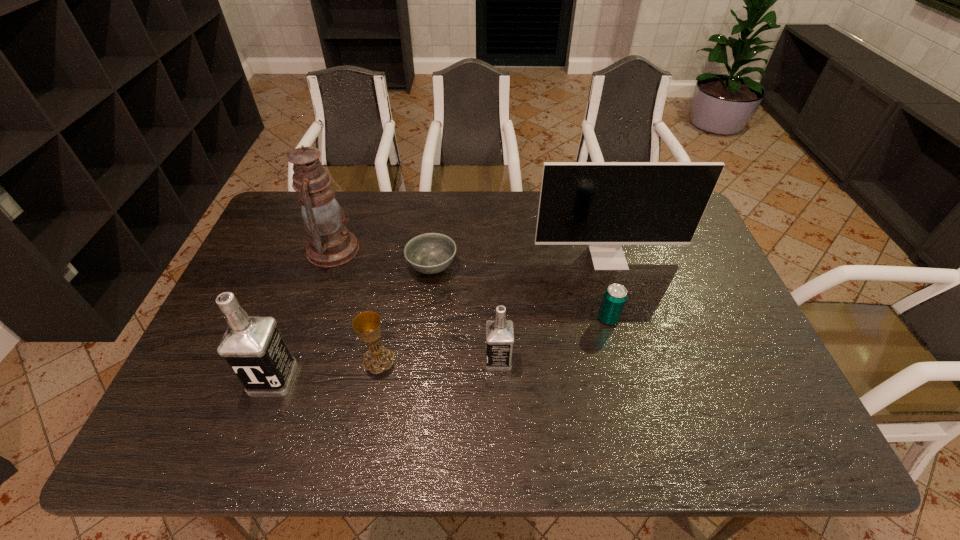
Locate an element on the screen. vacant space located 0.300m on the front label of the fifth object from left to right is located at coordinates (367, 360).

Find the location of a particular element. The height and width of the screenshot is (540, 960). vacant space located 0.320m on the front label of the fifth object from left to right is located at coordinates (359, 360).

You are a GUI agent. You are given a task and a screenshot of the screen. Output one action in this format:
    pyautogui.click(x=<x>, y=<y>)
    Task: Click on the vacant space located 0.310m on the right of the oil lamp
    
    Given the screenshot: What is the action you would take?
    pyautogui.click(x=457, y=249)

Where is `vacant area situated on the front-facing side of the monitor`? The height and width of the screenshot is (540, 960). vacant area situated on the front-facing side of the monitor is located at coordinates (636, 353).

Find the location of `free point located on the front of the bowl`. free point located on the front of the bowl is located at coordinates click(418, 399).

Locate an element on the screen. free spot located on the right of the fourth farthest object is located at coordinates (739, 319).

Find the location of a particular element. The width and height of the screenshot is (960, 540). blank area located 0.260m on the right of the chalice is located at coordinates (496, 360).

Identify the location of object that is at the far edge. (x=331, y=244).

Image resolution: width=960 pixels, height=540 pixels. Identify the location of object present at the near edge. (253, 347).

Image resolution: width=960 pixels, height=540 pixels. In order to click on object that is at the left edge in this screenshot , I will do 253,347.